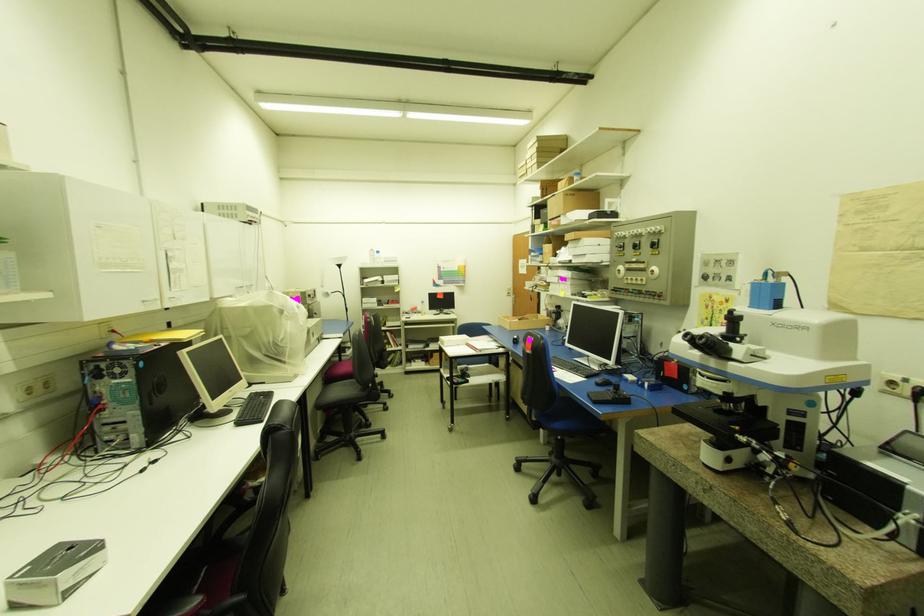
At what (x,y) coordinates should I click in order to perform the action: click on silver tissue box. Please return your answer as a coordinate pair (x, y). The height and width of the screenshot is (616, 924). Looking at the image, I should click on (55, 573).